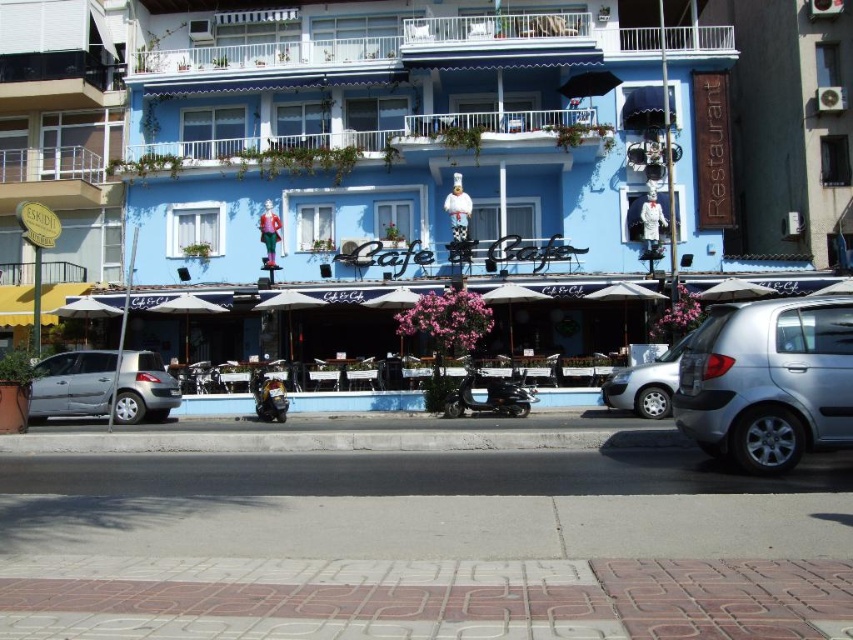
You are a delivery person who needs to park your silver metallic car at center as close as possible to the blue matte building at center. Given that the parking space available is 5 meters long, can you park your car close enough to the building?

The blue matte building at center and silver metallic car at center are 10.47 meters apart from each other. Since the parking space is only 5 meters long, the car cannot be parked close enough to the building as the distance is more than double the parking space length.

You are standing in the street and see the blue matte building at center and the shiny black motorcycle at center. Which object is positioned to the left?

The shiny black motorcycle at center is positioned to the left of the blue matte building at center.

You are standing at the point marked by the coordinate point (416, 163) in the image. What can you see directly in front of you?

The blue matte building at center is directly in front of you at the point marked by the coordinate point (416, 163).